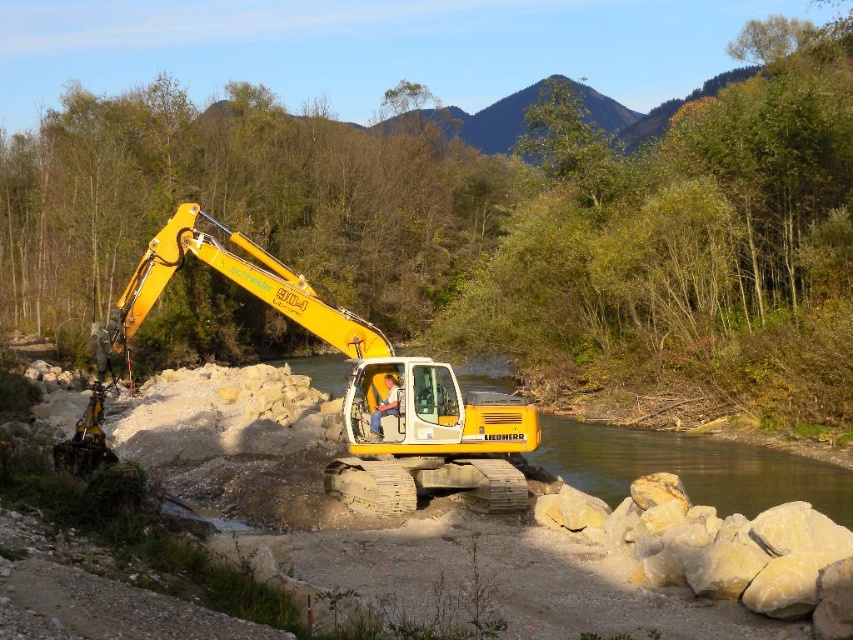
Can you confirm if yellow rubber excavator at center is positioned above clear water at center?

Indeed, yellow rubber excavator at center is positioned over clear water at center.

Consider the image. Does yellow rubber excavator at center have a greater width compared to clear water at center?

In fact, yellow rubber excavator at center might be narrower than clear water at center.

Is point (397, 396) farther from camera compared to point (618, 497)?

No, (397, 396) is in front of (618, 497).

Identify the location of yellow rubber excavator at center. The width and height of the screenshot is (853, 640). (358, 385).